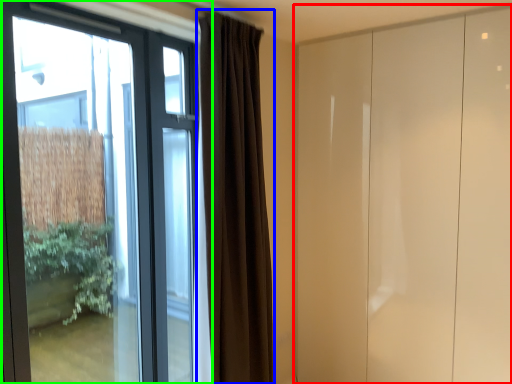
Question: Considering the real-world distances, which object is farthest from door (highlighted by a red box)? curtain (highlighted by a blue box) or window (highlighted by a green box)?

Choices:
 (A) curtain
 (B) window

Answer: (B)